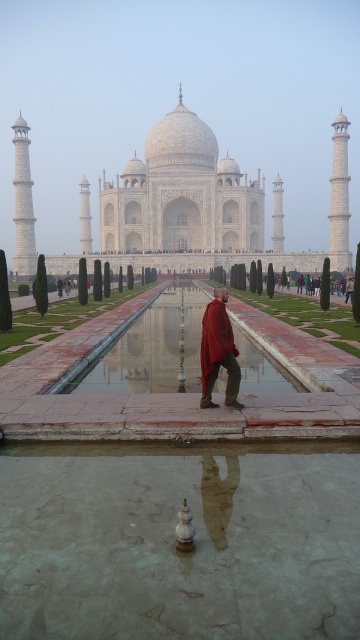
Question: Is shiny reflective water at center closer to the viewer compared to red velvet robe at center?

Choices:
 (A) yes
 (B) no

Answer: (B)

Question: Which of the following is the closest to the observer?

Choices:
 (A) shiny reflective water at center
 (B) red velvet robe at center

Answer: (B)

Question: Considering the relative positions of shiny reflective water at center and red velvet robe at center in the image provided, where is shiny reflective water at center located with respect to red velvet robe at center?

Choices:
 (A) below
 (B) above

Answer: (A)

Question: Among these objects, which one is farthest from the camera?

Choices:
 (A) shiny reflective water at center
 (B) red velvet robe at center

Answer: (A)

Question: Does shiny reflective water at center appear over red velvet robe at center?

Choices:
 (A) no
 (B) yes

Answer: (A)

Question: Which point is farther from the camera taking this photo?

Choices:
 (A) (219, 305)
 (B) (285, 372)

Answer: (B)